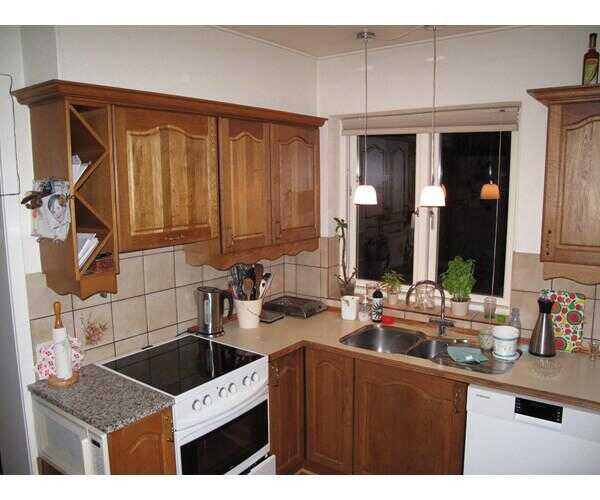
You are a GUI agent. You are given a task and a screenshot of the screen. Output one action in this format:
    pyautogui.click(x=<x>, y=<y>)
    Task: Click on the white dishwasher
    This screenshot has height=500, width=600.
    Given the screenshot: What is the action you would take?
    pyautogui.click(x=508, y=456)